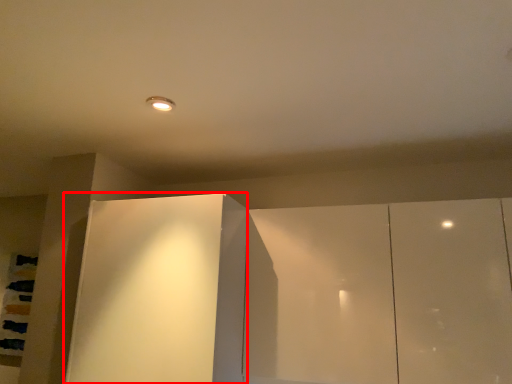
Question: From the image's perspective, what is the correct spatial relationship of glass door (annotated by the red box) in relation to cupboard?

Choices:
 (A) above
 (B) below

Answer: (B)